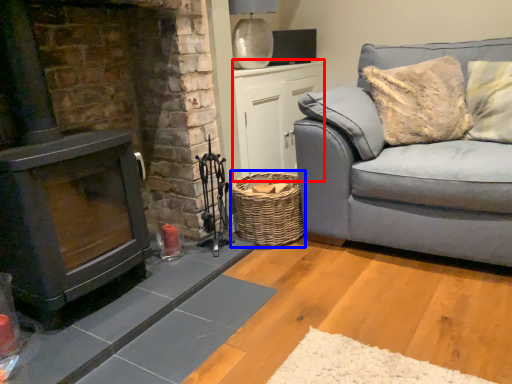
Question: Among these objects, which one is nearest to the camera, table (highlighted by a red box) or basket (highlighted by a blue box)?

Choices:
 (A) table
 (B) basket

Answer: (B)